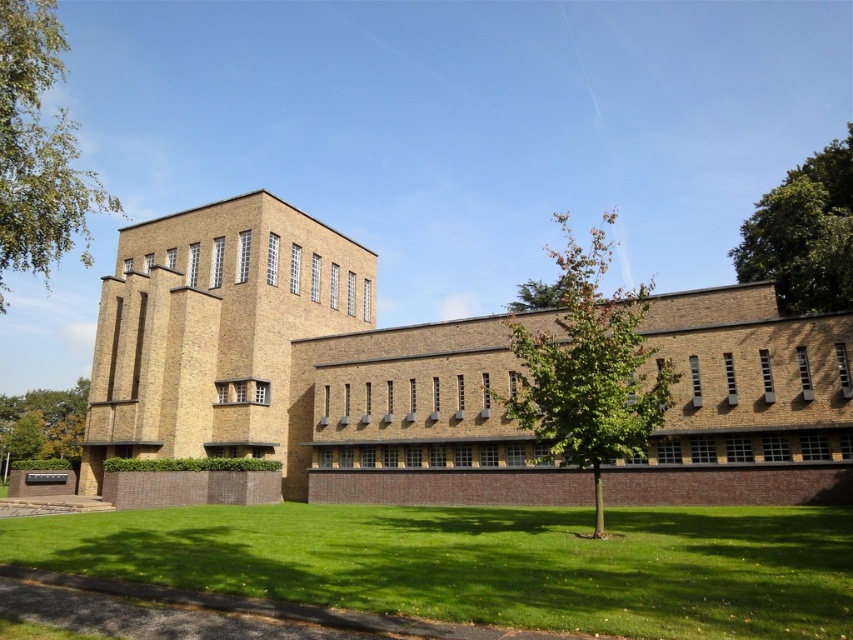
Question: Based on their relative distances, which object is nearer to the green leafy tree at upper right?

Choices:
 (A) green grass at lower center
 (B) green leafy tree at center
 (C) green leafy tree at lower left

Answer: (A)

Question: Which point appears farthest from the camera in this image?

Choices:
 (A) (74, 236)
 (B) (637, 451)
 (C) (738, 259)

Answer: (A)

Question: Which point is closer to the camera taking this photo?

Choices:
 (A) (607, 422)
 (B) (74, 531)
 (C) (47, 390)

Answer: (A)

Question: Does green grass at lower center appear on the left side of green leafy tree at upper right?

Choices:
 (A) no
 (B) yes

Answer: (B)

Question: Does green leafy tree at left lie in front of green leafy tree at upper right?

Choices:
 (A) no
 (B) yes

Answer: (B)

Question: Does green leafy tree at center come in front of green leafy tree at lower left?

Choices:
 (A) yes
 (B) no

Answer: (A)